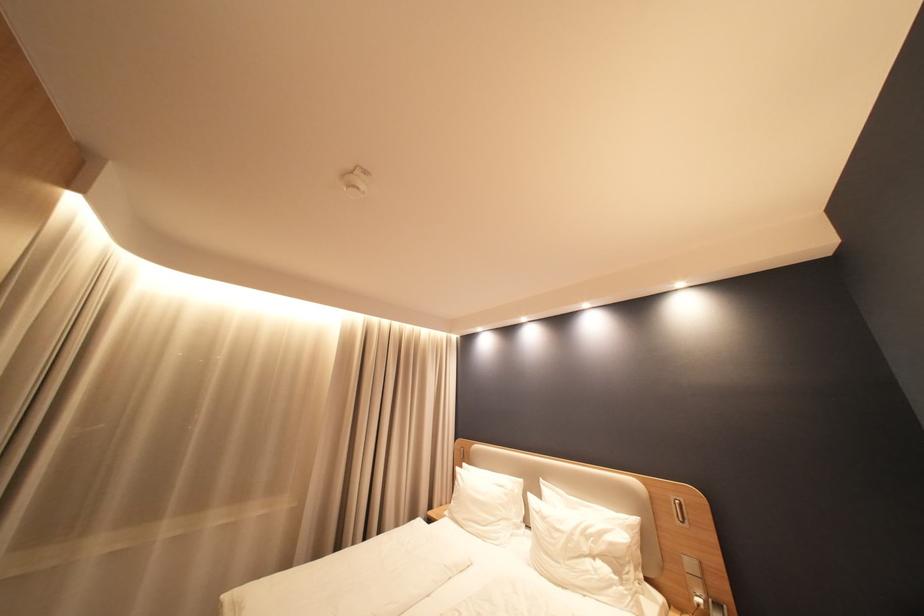
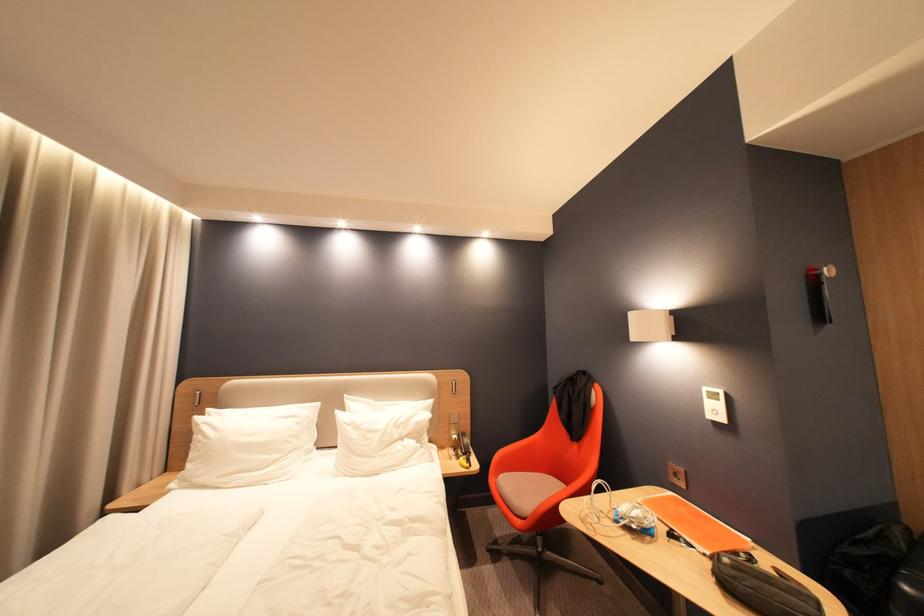
Locate, in the second image, the point that corresponds to pixel 468 475 in the first image.

(213, 424)